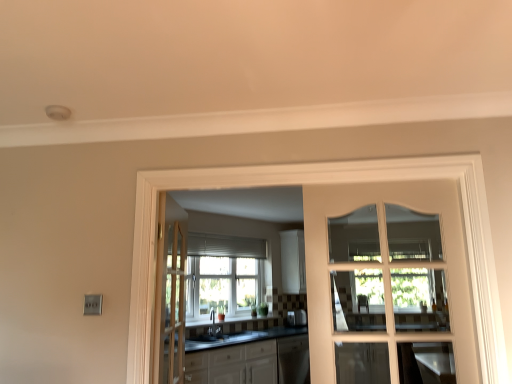
Question: From the image's perspective, is light brown wooden door at center, the first door when ordered from back to front, above white glossy cabinets at center?

Choices:
 (A) no
 (B) yes

Answer: (B)

Question: Does light brown wooden door at center, which ranks as the 2th door in front-to-back order, have a lesser height compared to white glossy cabinets at center?

Choices:
 (A) yes
 (B) no

Answer: (B)

Question: Is light brown wooden door at center, the first door when ordered from back to front, positioned with its back to white glossy cabinets at center?

Choices:
 (A) yes
 (B) no

Answer: (B)

Question: Does light brown wooden door at center, which is the 1th door from left to right, have a greater height compared to white glossy cabinets at center?

Choices:
 (A) no
 (B) yes

Answer: (B)

Question: From a real-world perspective, is light brown wooden door at center, which ranks as the 2th door in front-to-back order, under white glossy cabinets at center?

Choices:
 (A) no
 (B) yes

Answer: (A)

Question: Considering the positions of light brown wooden door at center, which ranks as the 2th door in front-to-back order, and matte black sink at center in the image, is light brown wooden door at center, which ranks as the 2th door in front-to-back order, wider or thinner than matte black sink at center?

Choices:
 (A) thin
 (B) wide

Answer: (A)

Question: From a real-world perspective, is light brown wooden door at center, which is the 1th door from left to right, physically located above or below matte black sink at center?

Choices:
 (A) above
 (B) below

Answer: (A)

Question: In the image, is light brown wooden door at center, the first door when ordered from back to front, positioned in front of or behind matte black sink at center?

Choices:
 (A) front
 (B) behind

Answer: (A)

Question: From the image's perspective, is light brown wooden door at center, the first door when ordered from back to front, located above or below matte black sink at center?

Choices:
 (A) above
 (B) below

Answer: (A)

Question: Considering the positions of light brown wooden door at center, which is the 2th door in right-to-left order, and white glass door at center in the image, is light brown wooden door at center, which is the 2th door in right-to-left order, bigger or smaller than white glass door at center?

Choices:
 (A) small
 (B) big

Answer: (A)

Question: Is light brown wooden door at center, which is the 1th door from left to right, taller or shorter than white glass door at center?

Choices:
 (A) tall
 (B) short

Answer: (A)

Question: In the image, is light brown wooden door at center, which ranks as the 2th door in front-to-back order, on the left side or the right side of white glass door at center?

Choices:
 (A) right
 (B) left

Answer: (B)

Question: Considering the positions of light brown wooden door at center, the first door when ordered from back to front, and white glass door at center in the image, is light brown wooden door at center, the first door when ordered from back to front, wider or thinner than white glass door at center?

Choices:
 (A) wide
 (B) thin

Answer: (A)

Question: Visually, is light brown wooden door at center, which is the 2th door in right-to-left order, positioned to the left or to the right of satin silver toaster at center?

Choices:
 (A) right
 (B) left

Answer: (B)

Question: Looking at their shapes, would you say light brown wooden door at center, which is the 2th door in right-to-left order, is wider or thinner than satin silver toaster at center?

Choices:
 (A) wide
 (B) thin

Answer: (B)